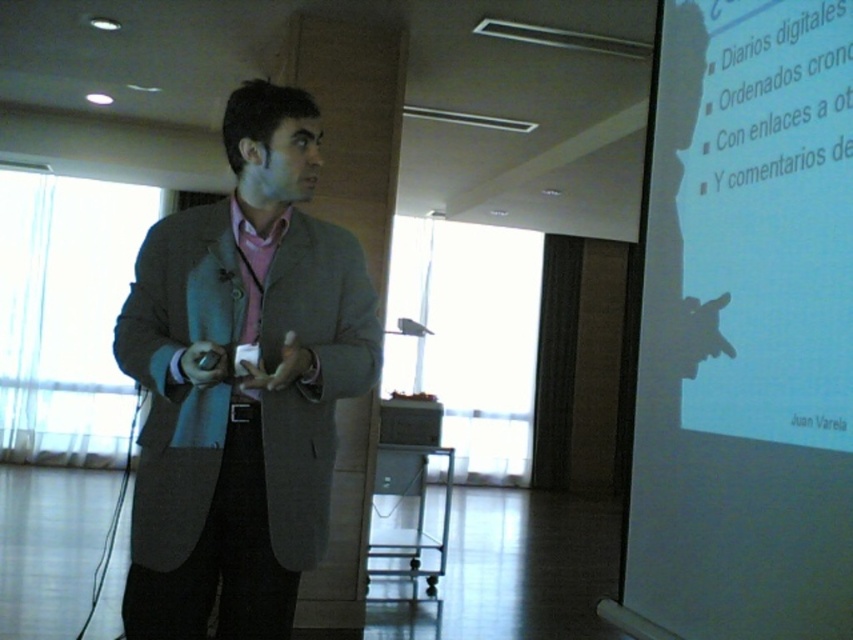
Does white matte projection screen at right have a lesser height compared to matte gray blazer at center?

In fact, white matte projection screen at right may be taller than matte gray blazer at center.

Between white matte projection screen at right and matte gray blazer at center, which one is positioned higher?

Positioned higher is white matte projection screen at right.

Which is in front, point (722, 349) or point (280, 609)?

Positioned in front is point (280, 609).

This screenshot has width=853, height=640. I want to click on white matte projection screen at right, so click(x=744, y=330).